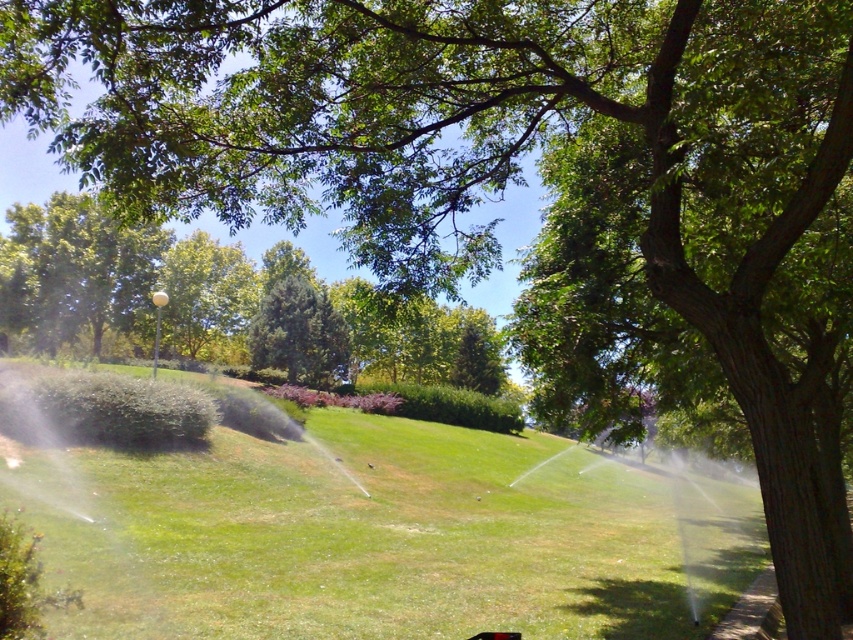
Is green grass at center bigger than green textured evergreen tree at center?

Correct, green grass at center is larger in size than green textured evergreen tree at center.

From the picture: Does green grass at center have a smaller size compared to green textured evergreen tree at center?

No, green grass at center is not smaller than green textured evergreen tree at center.

Which is in front, point (132, 506) or point (253, 337)?

Point (132, 506) is more forward.

Locate an element on the screen. green grass at center is located at coordinates (384, 536).